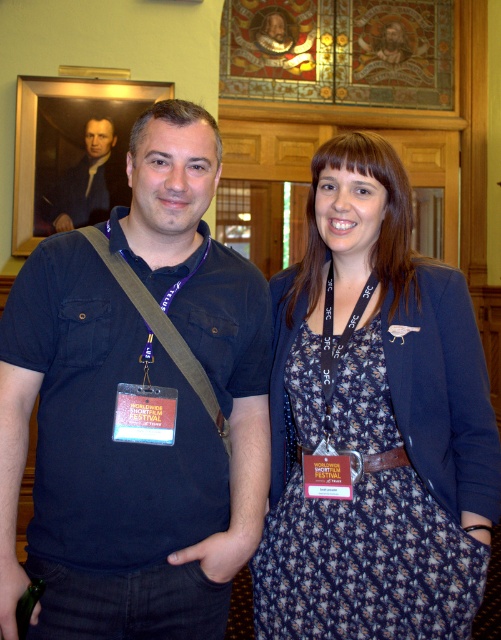
Question: Is floral dress at center below white fabric lanyard at center?

Choices:
 (A) no
 (B) yes

Answer: (B)

Question: Which of the following is the closest to the observer?

Choices:
 (A) (205, 632)
 (B) (77, 184)

Answer: (A)

Question: Can you confirm if dark blue shirt at center is positioned above floral dress at center?

Choices:
 (A) yes
 (B) no

Answer: (A)

Question: Which point appears farthest from the camera in this image?

Choices:
 (A) (480, 413)
 (B) (86, 150)
 (C) (173, 433)
 (D) (344, 349)

Answer: (B)

Question: Which of these objects is positioned farthest from the white fabric lanyard at center?

Choices:
 (A) dark blue shirt at center
 (B) orange card at center
 (C) smooth white face at upper left
 (D) plastic badge at center

Answer: (C)

Question: Can you confirm if dark blue shirt at center is positioned below orange card at center?

Choices:
 (A) no
 (B) yes

Answer: (A)